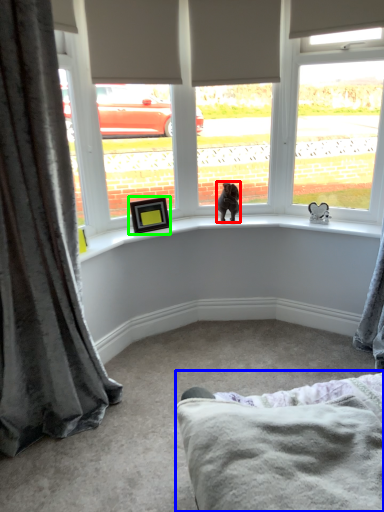
Question: Based on their relative distances, which object is farther from animal (highlighted by a red box)? Choose from bedding (highlighted by a blue box) and picture frame (highlighted by a green box).

Choices:
 (A) bedding
 (B) picture frame

Answer: (A)